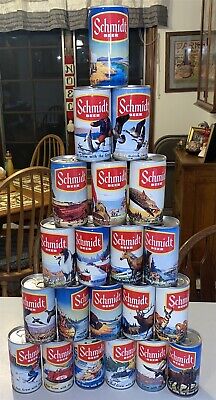
The image size is (216, 400). Identify the location of chair. (10, 274), (61, 149), (187, 242).